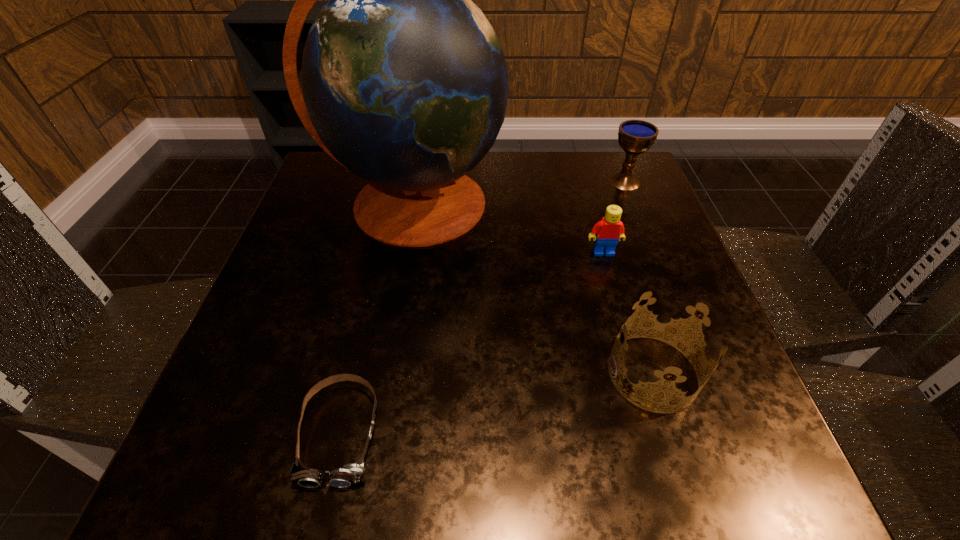
In the image, there is a desktop. Identify the location of vacant area at the far edge. This screenshot has height=540, width=960. (471, 177).

At what (x,y) coordinates should I click in order to perform the action: click on vacant space at the near edge of the desktop. Please return your answer as a coordinate pair (x, y). Looking at the image, I should click on (629, 446).

At what (x,y) coordinates should I click in order to perform the action: click on vacant space at the left edge of the desktop. Please return your answer as a coordinate pair (x, y). Looking at the image, I should click on (276, 334).

Identify the location of free space at the right edge of the desktop. Image resolution: width=960 pixels, height=540 pixels. (630, 249).

In the image, there is a desktop. At what (x,y) coordinates should I click in order to perform the action: click on vacant space at the far left corner. Please return your answer as a coordinate pair (x, y). The image size is (960, 540). Looking at the image, I should click on (342, 206).

This screenshot has height=540, width=960. In the image, there is a desktop. In order to click on free space at the far right corner in this screenshot , I will do `click(617, 192)`.

This screenshot has width=960, height=540. What are the coordinates of `vacant area that lies between the tallest object and the Lego` in the screenshot? It's located at (508, 228).

Where is `free spot between the Lego and the goggles`? Image resolution: width=960 pixels, height=540 pixels. free spot between the Lego and the goggles is located at coordinates (471, 343).

Find the location of `free spot between the goggles and the crown`. free spot between the goggles and the crown is located at coordinates coord(496,403).

Locate an element on the screen. The height and width of the screenshot is (540, 960). vacant space that's between the crown and the shortest object is located at coordinates coord(496,403).